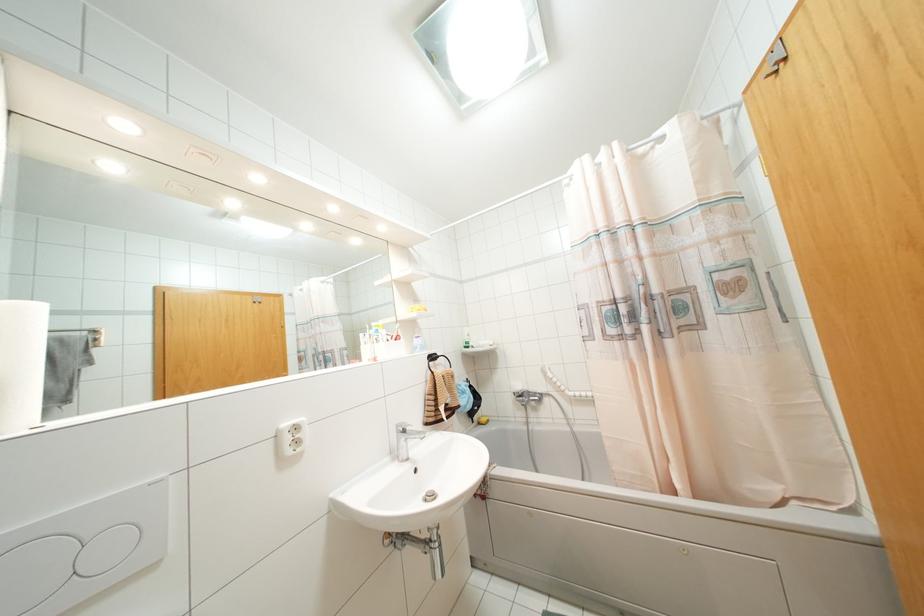
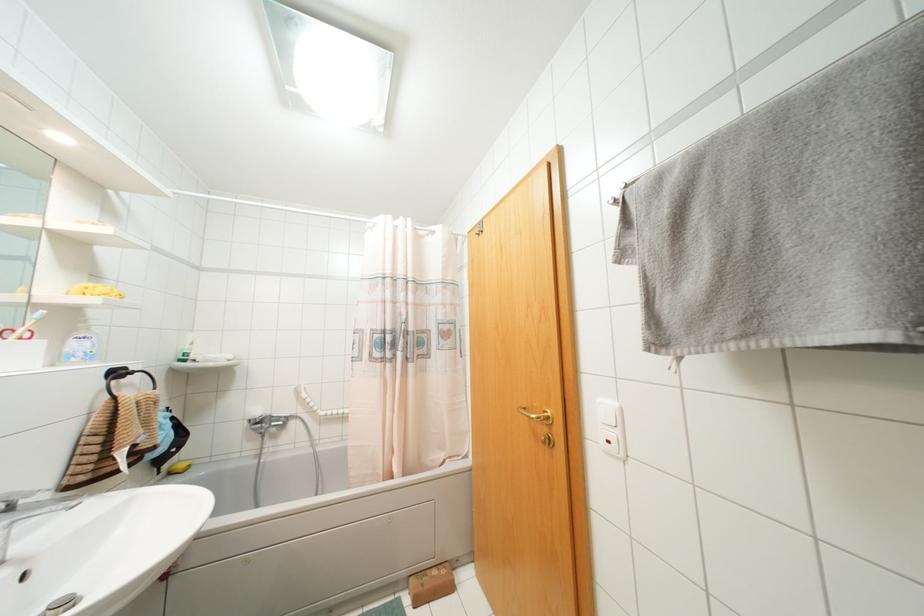
The point at (517, 387) is marked in the first image. Where is the corresponding point in the second image?

(258, 411)